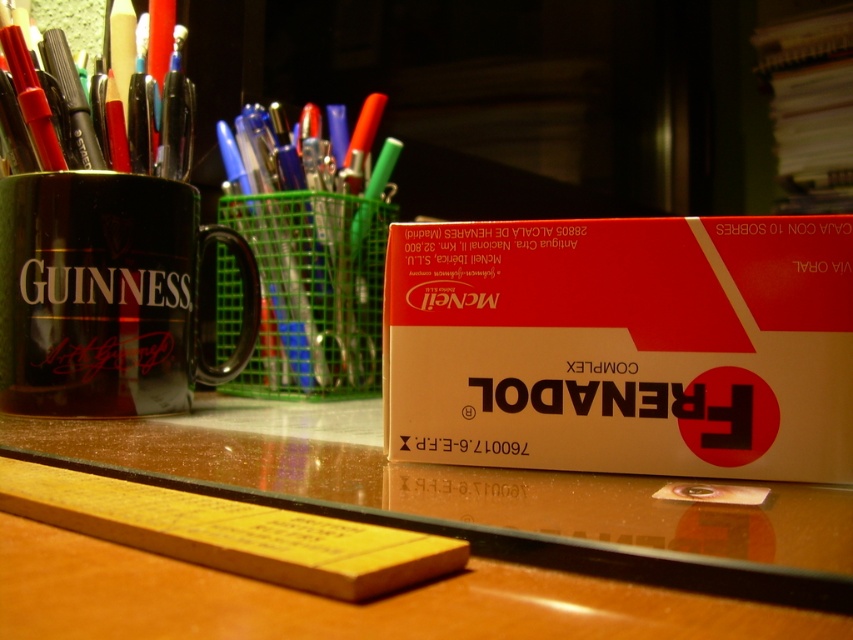
You need to pack these items into a small container. Which item, the matte cardboard box at center or the matte black mug at left, will fit more easily into the container?

The matte cardboard box at center has a smaller size compared to the matte black mug at left, so it will fit more easily into the container.

You have a small toy car that is 5 inches long. You want to place it on the desk between the matte cardboard box at center and the brown wooden table at center. Will the toy car fit in the space between them?

The space between the matte cardboard box at center and the brown wooden table at center is only 4.79 inches, which is shorter than the toy car that is 5 inches long. Therefore, the toy car will not fit in that space.

You are organizing items on the brown wooden table at center and the translucent plastic pen holder at center. If you want to place a new pen on top of the pen holder, where should you put it?

The translucent plastic pen holder at center is positioned above the brown wooden table at center, so placing the new pen on top of the pen holder would be appropriate.